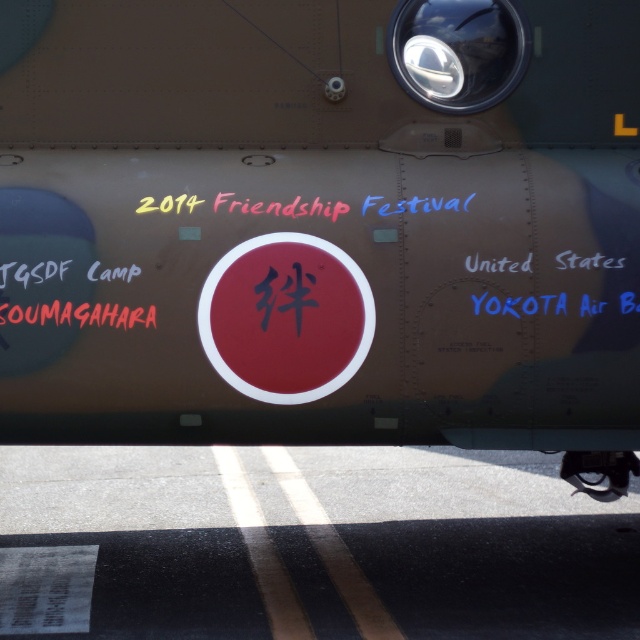
Question: Can you confirm if black asphalt at lower center is thinner than metallic silver cockpit at upper center?

Choices:
 (A) no
 (B) yes

Answer: (A)

Question: Which point appears closest to the camera in this image?

Choices:
 (A) (420, 35)
 (B) (376, 502)

Answer: (A)

Question: Which object appears farthest from the camera in this image?

Choices:
 (A) black asphalt at lower center
 (B) metallic silver cockpit at upper center

Answer: (A)

Question: Observing the image, what is the correct spatial positioning of black asphalt at lower center in reference to metallic silver cockpit at upper center?

Choices:
 (A) right
 (B) left

Answer: (B)

Question: Can you confirm if black asphalt at lower center is bigger than metallic silver cockpit at upper center?

Choices:
 (A) yes
 (B) no

Answer: (A)

Question: Among these objects, which one is farthest from the camera?

Choices:
 (A) metallic silver cockpit at upper center
 (B) black asphalt at lower center

Answer: (B)